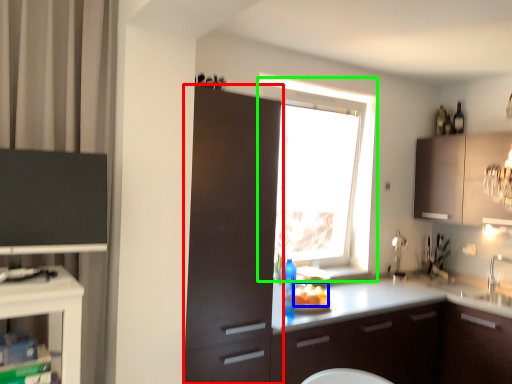
Question: Based on their relative distances, which object is nearer to cabinetry (highlighted by a red box)? Choose from food (highlighted by a blue box) and window (highlighted by a green box).

Choices:
 (A) food
 (B) window

Answer: (A)